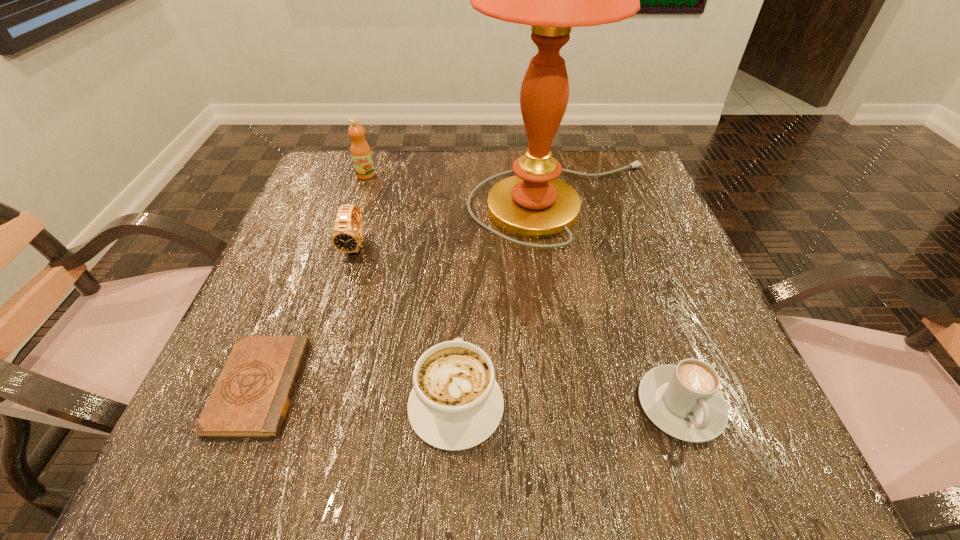
You are a GUI agent. You are given a task and a screenshot of the screen. Output one action in this format:
    pyautogui.click(x=<x>, y=<y>)
    Task: Click on the vacant region at the near right corner of the desktop
    
    Given the screenshot: What is the action you would take?
    pyautogui.click(x=739, y=436)

Where is `free spot between the orange juice and the shortest object`? free spot between the orange juice and the shortest object is located at coordinates (312, 281).

This screenshot has height=540, width=960. Find the location of `empty location between the fifth shortest object and the shorter cappuccino`. empty location between the fifth shortest object and the shorter cappuccino is located at coordinates (523, 289).

Where is `free area in between the left cappuccino and the shortest object`? This screenshot has width=960, height=540. free area in between the left cappuccino and the shortest object is located at coordinates (358, 395).

At what (x,y) coordinates should I click in order to perform the action: click on vacant region between the left cappuccino and the orange juice. Please return your answer as a coordinate pair (x, y). The image size is (960, 540). Looking at the image, I should click on (411, 289).

Locate an element on the screen. free area in between the shortest object and the lamp is located at coordinates tap(412, 294).

At what (x,y) coordinates should I click in order to perform the action: click on vacant region between the watch and the diary. Please return your answer as a coordinate pair (x, y). This screenshot has height=540, width=960. Looking at the image, I should click on (308, 316).

Find the location of a particular element. free space between the right cappuccino and the orange juice is located at coordinates (523, 289).

The width and height of the screenshot is (960, 540). I want to click on empty space that is in between the left cappuccino and the tallest object, so click(510, 303).

At what (x,y) coordinates should I click in order to perform the action: click on unoccupied area between the watch and the left cappuccino. Please return your answer as a coordinate pair (x, y). Image resolution: width=960 pixels, height=540 pixels. Looking at the image, I should click on (406, 325).